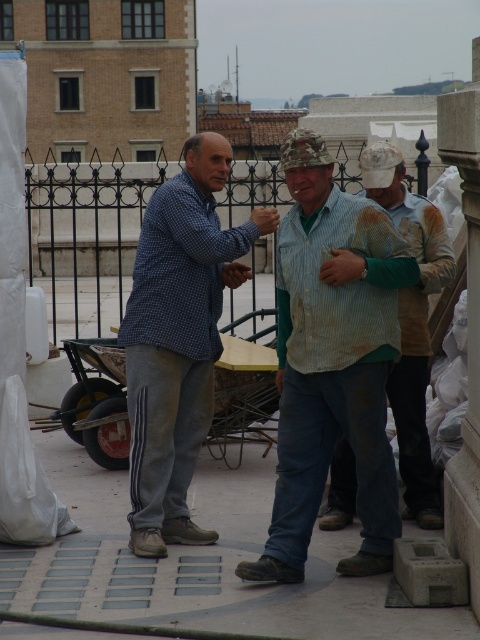
Based on the photo, you are standing on a rooftop and want to reach a point marked at coordinates point (396, 508). If you can walk 50 feet in 1 minute, how long will it take you to reach that point?

The distance between you and point (396, 508) is 41.49 feet. At a walking speed of 50 feet per minute, it would take approximately 0.83 minutes, which is about 50 seconds, to reach the point.

You are a photographer on a rooftop and see the striped cotton shirt at center and the rusty metal shirt at center. Which one is positioned more to the left side?

The striped cotton shirt at center is positioned more to the left side.